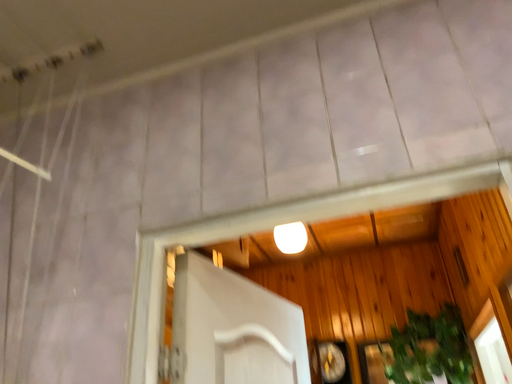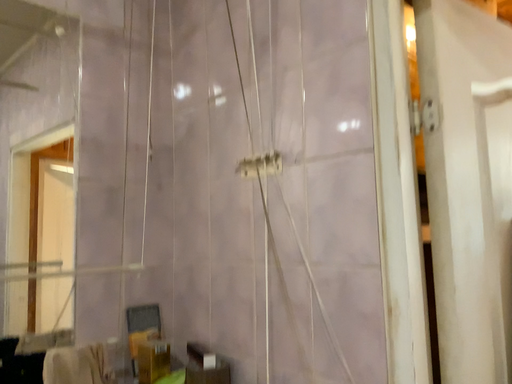
Question: Which way did the camera rotate in the video?

Choices:
 (A) rotated right
 (B) rotated left

Answer: (B)